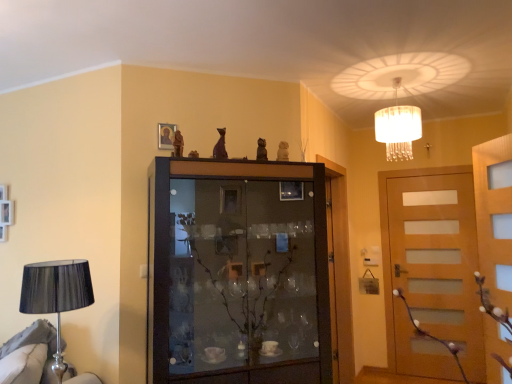
Locate an element on the screen. translucent glass chandelier at upper center is located at coordinates (398, 127).

Image resolution: width=512 pixels, height=384 pixels. In order to click on matte gold picture frame at upper center in this screenshot , I will do `click(166, 135)`.

The height and width of the screenshot is (384, 512). What do you see at coordinates (237, 274) in the screenshot?
I see `brown wooden cupboard at center` at bounding box center [237, 274].

The width and height of the screenshot is (512, 384). Find the location of `wooden door at center, positioned as the 1th door in left-to-right order`. wooden door at center, positioned as the 1th door in left-to-right order is located at coordinates (339, 272).

At what (x,y) coordinates should I click in order to perform the action: click on light brown wood door at right, marked as the 1th door in a right-to-left arrangement. Please return your answer as a coordinate pair (x, y). Image resolution: width=512 pixels, height=384 pixels. Looking at the image, I should click on (434, 275).

Between wooden door at center, the second door viewed from the right, and metallic lampshade at left, which one has smaller width?

With smaller width is wooden door at center, the second door viewed from the right.

Which object is further away from the camera, wooden door at center, positioned as the 1th door in left-to-right order, or metallic lampshade at left?

wooden door at center, positioned as the 1th door in left-to-right order, is behind.

Does wooden door at center, positioned as the 1th door in left-to-right order, have a smaller size compared to metallic lampshade at left?

No, wooden door at center, positioned as the 1th door in left-to-right order, is not smaller than metallic lampshade at left.

Are wooden door at center, positioned as the 1th door in left-to-right order, and metallic lampshade at left far apart?

Yes, wooden door at center, positioned as the 1th door in left-to-right order, is far from metallic lampshade at left.

Would you say wooden door at center, positioned as the 1th door in left-to-right order, is outside light brown wood door at right, marked as the 1th door in a right-to-left arrangement?

That's correct, wooden door at center, positioned as the 1th door in left-to-right order, is outside of light brown wood door at right, marked as the 1th door in a right-to-left arrangement.

Between wooden door at center, positioned as the 1th door in left-to-right order, and light brown wood door at right, placed as the 2th door when sorted from left to right, which one has smaller size?

light brown wood door at right, placed as the 2th door when sorted from left to right, is smaller.

From a real-world perspective, is wooden door at center, the second door viewed from the right, positioned above or below light brown wood door at right, marked as the 1th door in a right-to-left arrangement?

From a real-world perspective, wooden door at center, the second door viewed from the right, is physically above light brown wood door at right, marked as the 1th door in a right-to-left arrangement.

Which object is positioned more to the left, wooden door at center, the second door viewed from the right, or light brown wood door at right, placed as the 2th door when sorted from left to right?

Positioned to the left is wooden door at center, the second door viewed from the right.

Visually, is matte gold picture frame at upper center positioned to the left or to the right of brown wooden cupboard at center?

From the image, it's evident that matte gold picture frame at upper center is to the left of brown wooden cupboard at center.

Is brown wooden cupboard at center at the back of matte gold picture frame at upper center?

No, matte gold picture frame at upper center is not facing away from brown wooden cupboard at center.

Between matte gold picture frame at upper center and brown wooden cupboard at center, which one has smaller width?

With smaller width is matte gold picture frame at upper center.

Would you say matte gold picture frame at upper center is a long distance from brown wooden cupboard at center?

matte gold picture frame at upper center is actually quite close to brown wooden cupboard at center.

From a real-world perspective, is light brown wood door at right, marked as the 1th door in a right-to-left arrangement, on wooden door at center, positioned as the 1th door in left-to-right order?

Incorrect, from a real-world perspective, light brown wood door at right, marked as the 1th door in a right-to-left arrangement, is lower than wooden door at center, positioned as the 1th door in left-to-right order.

Which object is further away from the camera, light brown wood door at right, marked as the 1th door in a right-to-left arrangement, or wooden door at center, the second door viewed from the right?

light brown wood door at right, marked as the 1th door in a right-to-left arrangement, is more distant.

Can you see light brown wood door at right, placed as the 2th door when sorted from left to right, touching wooden door at center, the second door viewed from the right?

No, light brown wood door at right, placed as the 2th door when sorted from left to right, is not in contact with wooden door at center, the second door viewed from the right.

Is wooden door at center, the second door viewed from the right, bigger or smaller than brown wooden cupboard at center?

Clearly, wooden door at center, the second door viewed from the right, is smaller in size than brown wooden cupboard at center.

From a real-world perspective, between wooden door at center, the second door viewed from the right, and brown wooden cupboard at center, who is vertically lower?

In real-world perspective, wooden door at center, the second door viewed from the right, is lower.

Is wooden door at center, the second door viewed from the right, positioned in front of brown wooden cupboard at center?

No, wooden door at center, the second door viewed from the right, is behind brown wooden cupboard at center.

Could you tell me if metallic lampshade at left is facing brown wooden cupboard at center?

No, metallic lampshade at left is not facing towards brown wooden cupboard at center.

Can you tell me how much metallic lampshade at left and brown wooden cupboard at center differ in facing direction?

There is a 97.2-degree angle between the facing directions of metallic lampshade at left and brown wooden cupboard at center.

Considering the sizes of objects metallic lampshade at left and brown wooden cupboard at center in the image provided, who is shorter, metallic lampshade at left or brown wooden cupboard at center?

metallic lampshade at left is shorter.

Is metallic lampshade at left not inside brown wooden cupboard at center?

Yes.

In terms of height, does translucent glass chandelier at upper center look taller or shorter compared to light brown wood door at right, marked as the 1th door in a right-to-left arrangement?

In the image, translucent glass chandelier at upper center appears to be shorter than light brown wood door at right, marked as the 1th door in a right-to-left arrangement.

Is translucent glass chandelier at upper center outside of light brown wood door at right, placed as the 2th door when sorted from left to right?

translucent glass chandelier at upper center lies outside light brown wood door at right, placed as the 2th door when sorted from left to right,'s area.

Does translucent glass chandelier at upper center have a lesser width compared to light brown wood door at right, marked as the 1th door in a right-to-left arrangement?

No, translucent glass chandelier at upper center is not thinner than light brown wood door at right, marked as the 1th door in a right-to-left arrangement.

Which point is more forward, (x=411, y=113) or (x=465, y=343)?

The point (x=411, y=113) is closer to the camera.

You are a GUI agent. You are given a task and a screenshot of the screen. Output one action in this format:
    pyautogui.click(x=<x>, y=<y>)
    Task: Click on the furniture in front of the wooden door at center, positioned as the 1th door in left-to-right order
    
    Given the screenshot: What is the action you would take?
    pyautogui.click(x=29, y=355)

Locate an element on the screen. door that is on the right side of wooden door at center, positioned as the 1th door in left-to-right order is located at coordinates (434, 275).

When comparing their distances from metallic lampshade at left, does translucent glass chandelier at upper center or brown wooden cupboard at center seem closer?

brown wooden cupboard at center lies closer to metallic lampshade at left than the other object.

Which object lies further to the anchor point metallic lampshade at left, light brown wood door at right, placed as the 2th door when sorted from left to right, or translucent glass chandelier at upper center?

Based on the image, light brown wood door at right, placed as the 2th door when sorted from left to right, appears to be further to metallic lampshade at left.

Based on their spatial positions, is brown wooden cupboard at center or translucent glass chandelier at upper center further from light brown wood door at right, placed as the 2th door when sorted from left to right?

brown wooden cupboard at center.

When comparing their distances from wooden door at center, positioned as the 1th door in left-to-right order, does metallic lampshade at left or translucent glass chandelier at upper center seem closer?

translucent glass chandelier at upper center lies closer to wooden door at center, positioned as the 1th door in left-to-right order, than the other object.

From the image, which object appears to be nearer to translucent glass chandelier at upper center, metallic lampshade at left or matte gold picture frame at upper center?

matte gold picture frame at upper center lies closer to translucent glass chandelier at upper center than the other object.

Looking at the image, which one is located closer to brown wooden cupboard at center, metallic lampshade at left or matte gold picture frame at upper center?

matte gold picture frame at upper center is positioned closer to the anchor brown wooden cupboard at center.

Estimate the real-world distances between objects in this image. Which object is closer to light brown wood door at right, marked as the 1th door in a right-to-left arrangement, metallic lampshade at left or wooden door at center, positioned as the 1th door in left-to-right order?

wooden door at center, positioned as the 1th door in left-to-right order, lies closer to light brown wood door at right, marked as the 1th door in a right-to-left arrangement, than the other object.

Based on the photo, when comparing their distances from wooden door at center, the second door viewed from the right, does matte gold picture frame at upper center or brown wooden cupboard at center seem closer?

Among the two, brown wooden cupboard at center is located nearer to wooden door at center, the second door viewed from the right.

The image size is (512, 384). Find the location of `cupboard between metallic lampshade at left and translucent glass chandelier at upper center from left to right`. cupboard between metallic lampshade at left and translucent glass chandelier at upper center from left to right is located at coordinates (237, 274).

Locate an element on the screen. door between metallic lampshade at left and translucent glass chandelier at upper center is located at coordinates (339, 272).

I want to click on lamp located between brown wooden cupboard at center and light brown wood door at right, placed as the 2th door when sorted from left to right, in the left-right direction, so click(398, 127).

This screenshot has width=512, height=384. I want to click on door situated between matte gold picture frame at upper center and translucent glass chandelier at upper center from left to right, so click(x=339, y=272).